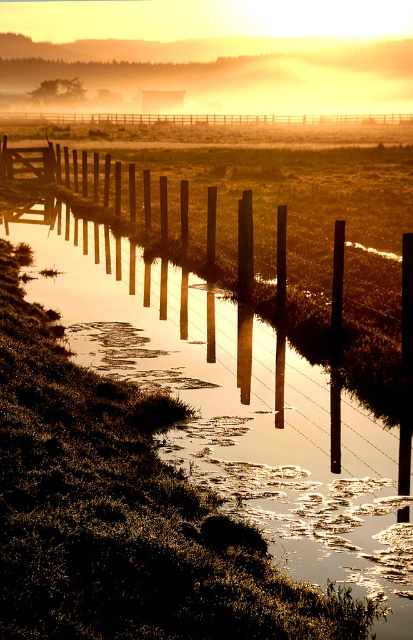
Question: Does smooth wooden fence at center have a greater width compared to wooden posts at center?

Choices:
 (A) no
 (B) yes

Answer: (A)

Question: Which is farther from the foggy mist at upper center?

Choices:
 (A) metallic water at center
 (B) smooth wooden fence at center
 (C) smooth wood post at center

Answer: (C)

Question: Which object is the farthest from the metallic pole at center-right?

Choices:
 (A) smooth wooden fence at center
 (B) foggy mist at upper center
 (C) metallic water at center
 (D) smooth wood post at center

Answer: (B)

Question: Which of the following is the closest to the observer?

Choices:
 (A) (330, 465)
 (B) (396, 570)
 (C) (289, 65)

Answer: (B)

Question: Is the position of metallic water at center more distant than that of wooden posts at center?

Choices:
 (A) yes
 (B) no

Answer: (B)

Question: In this image, where is metallic water at center located relative to smooth wooden fence at center?

Choices:
 (A) below
 (B) above

Answer: (A)